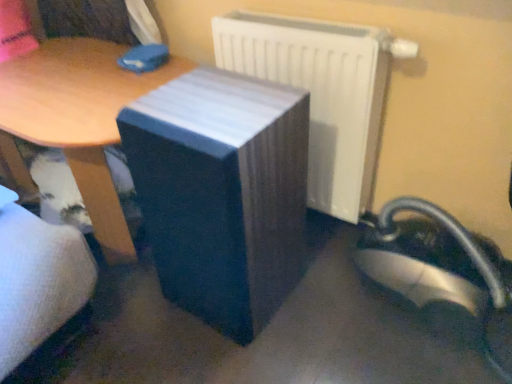
The width and height of the screenshot is (512, 384). Find the location of `vacant area on top of matte black speaker at center, which is counted as the 1th table, starting from the right (from a real-world perspective)`. vacant area on top of matte black speaker at center, which is counted as the 1th table, starting from the right (from a real-world perspective) is located at coordinates (218, 104).